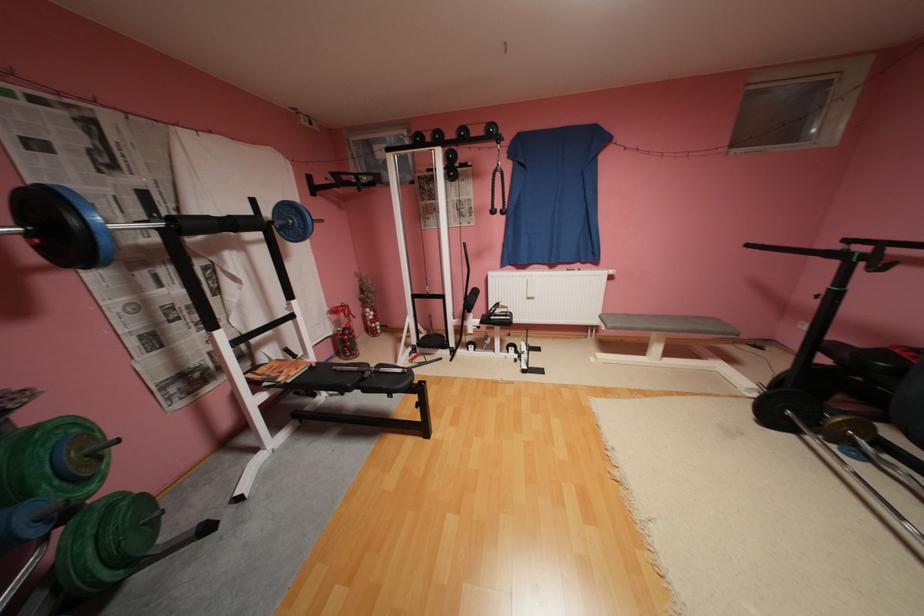
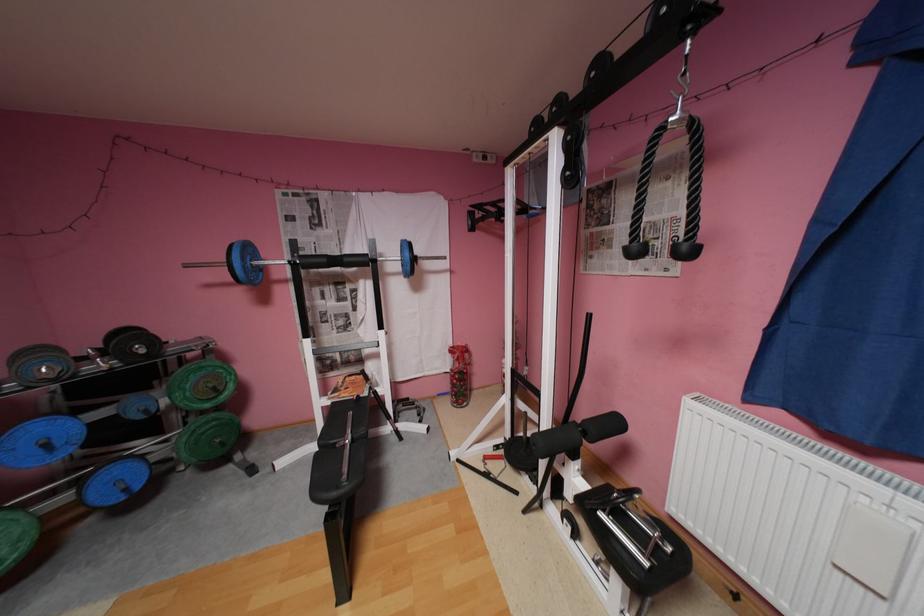
Locate, in the second image, the point that corresponds to point (484, 292) in the first image.

(624, 424)